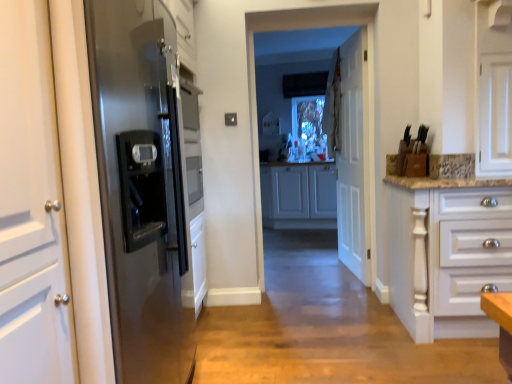
Image resolution: width=512 pixels, height=384 pixels. Identify the location of vacant space that is to the left of white wooden door at center. (302, 272).